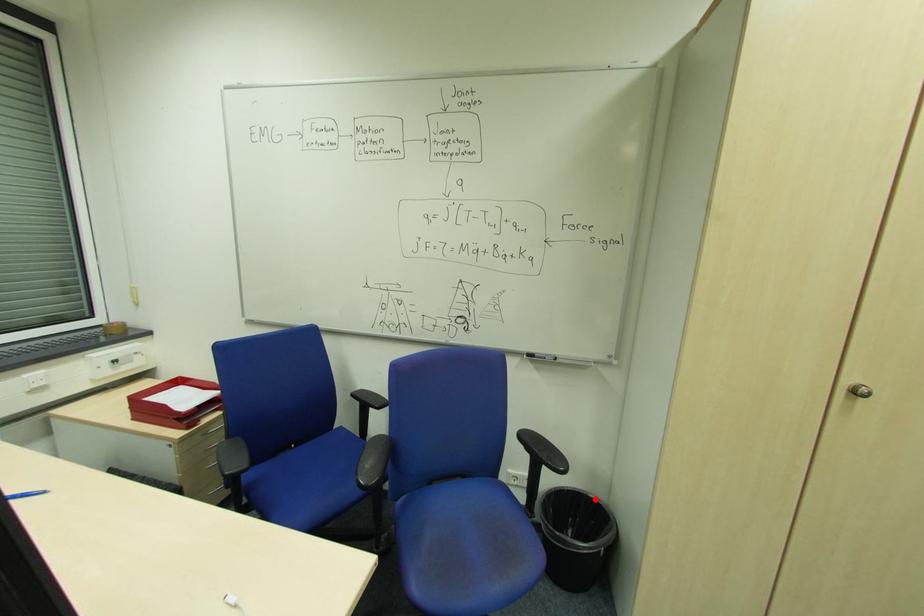
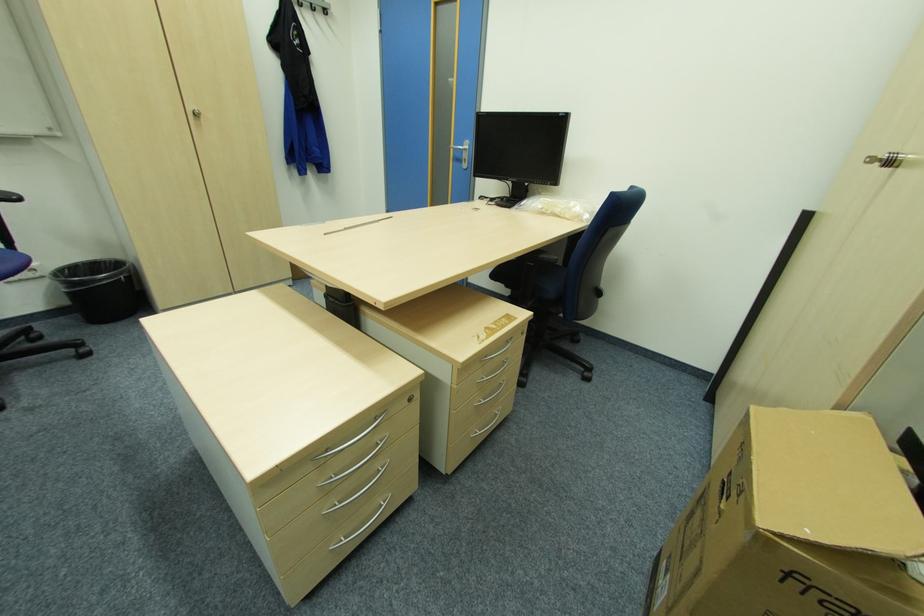
Locate, in the second image, the point that corresponds to the highlighted location in the first image.

(113, 261)